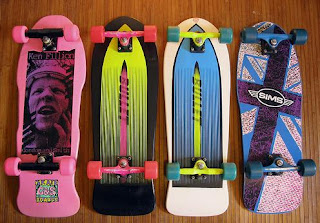
This screenshot has height=223, width=320. What are the coordinates of `wood floor` in the screenshot? It's located at (292, 11).